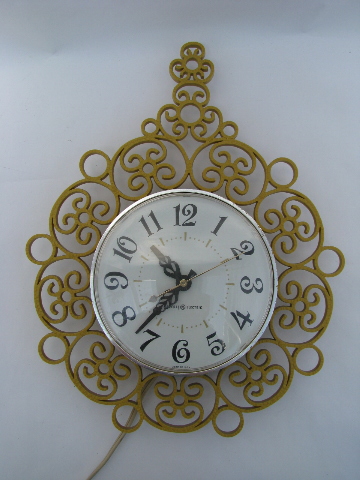
Where is `ornate border decoration`? The width and height of the screenshot is (360, 480). ornate border decoration is located at coordinates (215, 411).